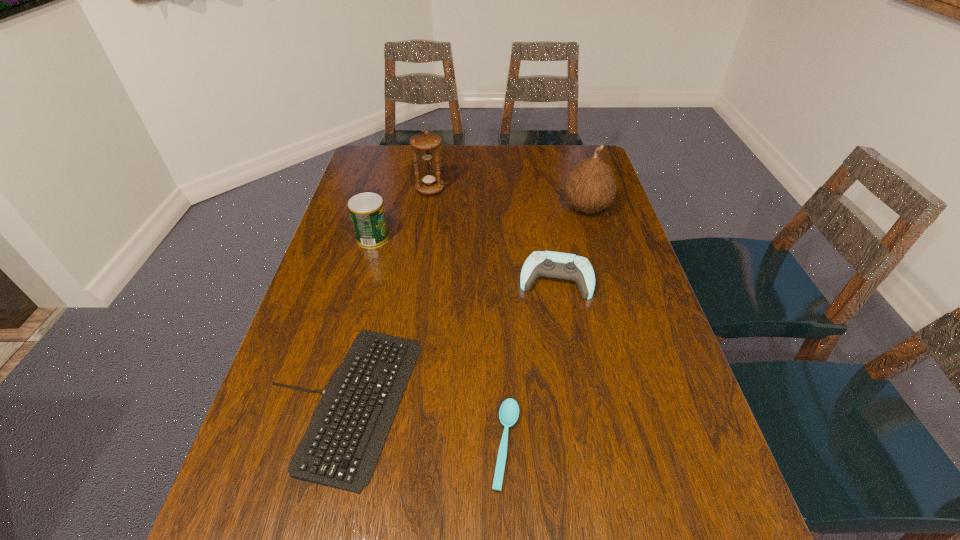
Identify the location of the tallest object. Image resolution: width=960 pixels, height=540 pixels. (590, 186).

The height and width of the screenshot is (540, 960). In order to click on hourglass in this screenshot , I will do `click(427, 143)`.

Locate an element on the screen. The width and height of the screenshot is (960, 540). can is located at coordinates (367, 213).

This screenshot has height=540, width=960. Identify the location of the fourth shortest object. (367, 213).

I want to click on the fourth tallest object, so click(x=557, y=265).

Locate an element on the screen. This screenshot has height=540, width=960. the third nearest object is located at coordinates (557, 265).

You are a GUI agent. You are given a task and a screenshot of the screen. Output one action in this format:
    pyautogui.click(x=<x>, y=<y>)
    Task: Click on the fifth tallest object
    
    Given the screenshot: What is the action you would take?
    pyautogui.click(x=340, y=449)

In order to click on the shortest object in this screenshot , I will do `click(509, 411)`.

Image resolution: width=960 pixels, height=540 pixels. What are the coordinates of `spoon` in the screenshot? It's located at (509, 411).

Identify the location of vacant space located on the surface of the tallest object. The height and width of the screenshot is (540, 960). (473, 208).